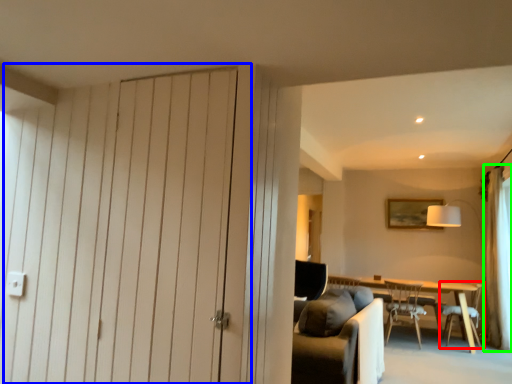
Question: Considering the real-world distances, which object is farthest from chair (highlighted by a red box)? door (highlighted by a blue box) or curtain (highlighted by a green box)?

Choices:
 (A) door
 (B) curtain

Answer: (A)